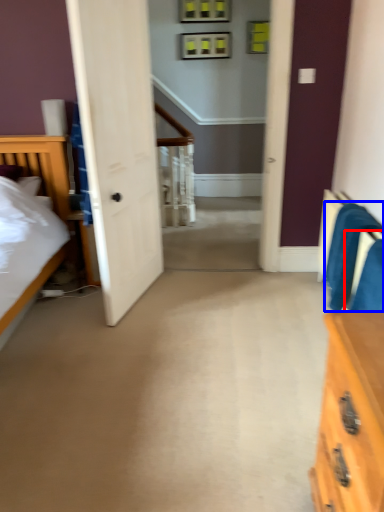
Question: Which object is further to the camera taking this photo, armchair (highlighted by a red box) or armchair (highlighted by a blue box)?

Choices:
 (A) armchair
 (B) armchair

Answer: (B)